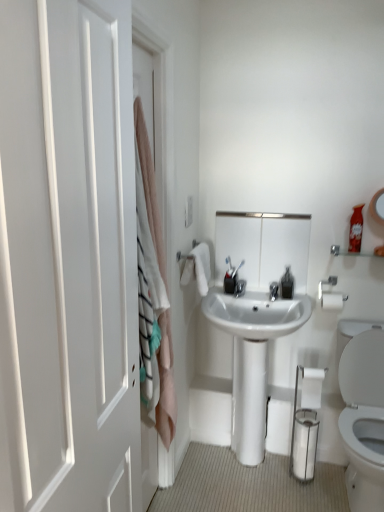
Question: Is white glossy sink at center in front of or behind white matte door at left in the image?

Choices:
 (A) front
 (B) behind

Answer: (B)

Question: Considering the positions of point (233, 313) and point (104, 22), is point (233, 313) closer or farther from the camera than point (104, 22)?

Choices:
 (A) closer
 (B) farther

Answer: (B)

Question: Based on their relative distances, which object is nearer to the white glossy medicine cabinet at center?

Choices:
 (A) white glossy toilet paper at lower right
 (B) pink fabric curtain at left
 (C) metallic silver toothbrush at center
 (D) clear plastic soap dispenser at center
 (E) white glossy sink at center

Answer: (D)

Question: Which is farther from the metallic silver toothbrush at center?

Choices:
 (A) white glossy medicine cabinet at center
 (B) white glossy sink at center
 (C) white matte door at left
 (D) pink fabric curtain at left
 (E) white glossy toilet paper at lower right

Answer: (C)